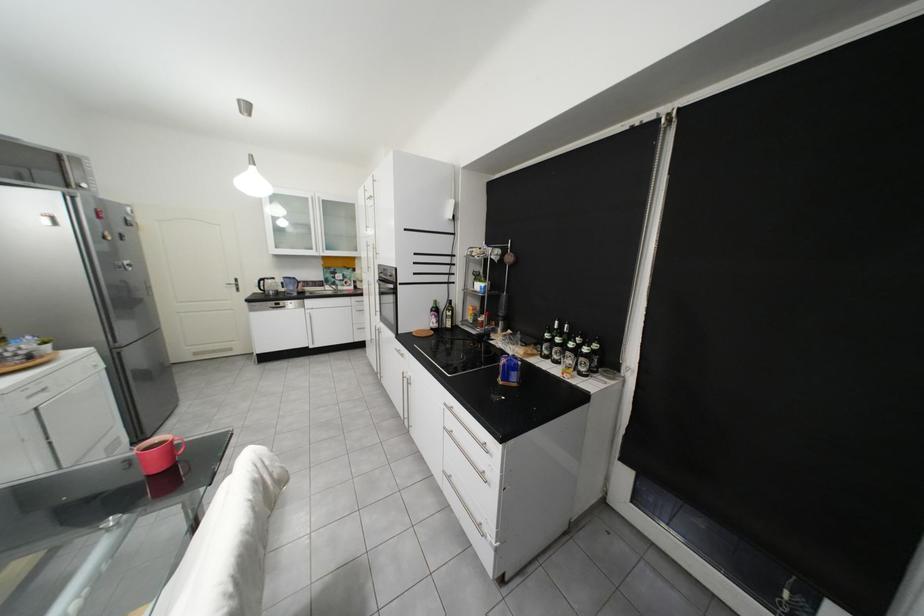
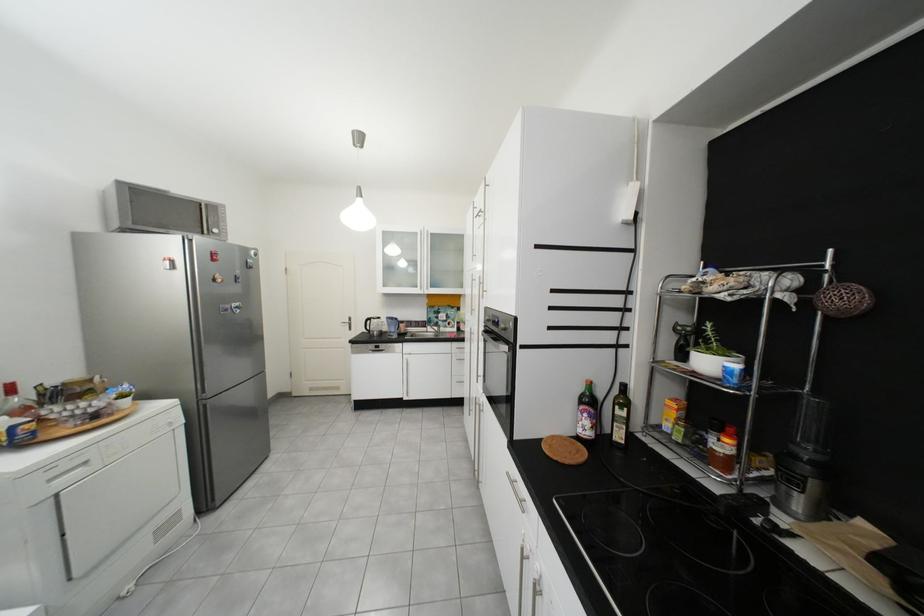
The point at (274, 281) is marked in the first image. Where is the corresponding point in the second image?

(381, 321)